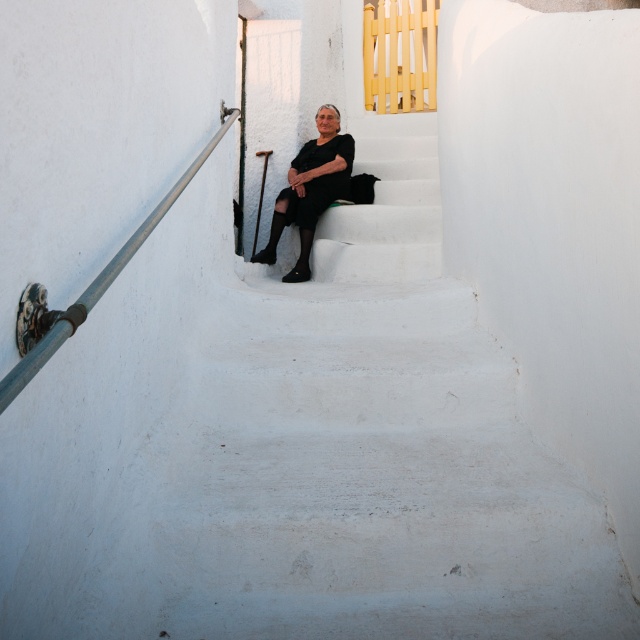
You are an interior designer assessing the layout of a staircase area. You notice the white matte stairs at center and the black matte dress at center. Which object takes up more space in the scene?

The black matte dress at center occupies more space than the white matte stairs at center.

You are a painter standing at the bottom of the stairs. You want to paint the black matte dress at center and the metallic gray handrail at left. Which object should you paint first if you want to start with the one closer to you?

The black matte dress at center is much taller as metallic gray handrail at left, so you should paint the black matte dress at center first since it is closer to you.

You are a photographer trying to capture the elderly woman in the scene. Since you want to focus on her dress, which object should you adjust your camera to focus on first, the white matte stairs at center or the black matte dress at center?

The white matte stairs at center is closer to the viewer than the black matte dress at center, so you should focus on the black matte dress at center first to ensure it is in sharp focus.